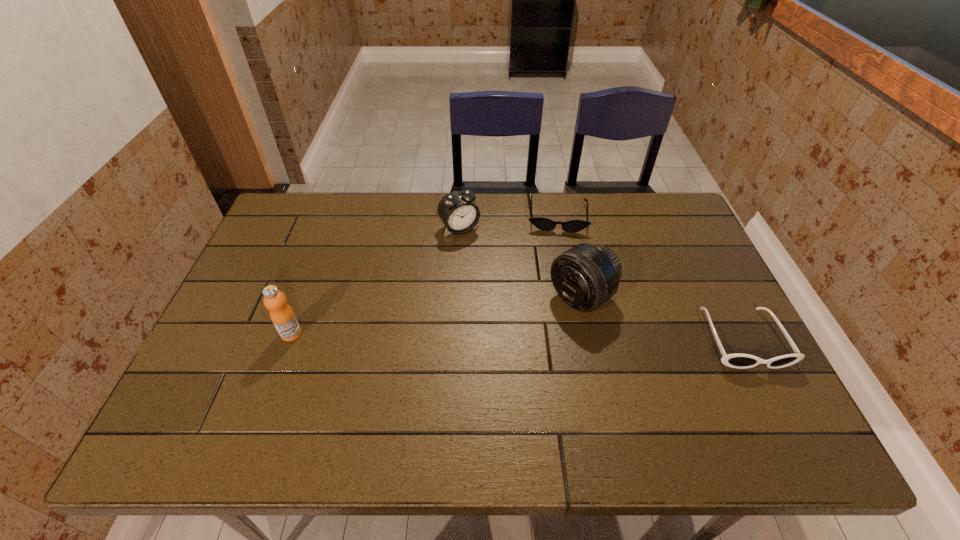
You are a GUI agent. You are given a task and a screenshot of the screen. Output one action in this format:
    pyautogui.click(x=<x>, y=<y>)
    Task: Click on the free space located on the front side of the third shortest object
    
    Given the screenshot: What is the action you would take?
    pyautogui.click(x=504, y=284)

Where is `free space located 0.240m on the front side of the third shortest object`? free space located 0.240m on the front side of the third shortest object is located at coordinates click(x=508, y=289).

Identify the location of vacant space located 0.320m on the front side of the third shortest object. The image size is (960, 540). (523, 308).

Where is `vacant space located 0.330m on the front-facing side of the shorter sunglasses`? vacant space located 0.330m on the front-facing side of the shorter sunglasses is located at coordinates (558, 315).

Identify the location of vacant space located on the front-facing side of the shorter sunglasses. The width and height of the screenshot is (960, 540). (558, 323).

Locate an element on the screen. The height and width of the screenshot is (540, 960). free space located 0.260m on the front-facing side of the shorter sunglasses is located at coordinates pyautogui.click(x=558, y=295).

Identify the location of vacant space situated on the front-facing side of the telephoto lens. Image resolution: width=960 pixels, height=540 pixels. (467, 379).

You are a GUI agent. You are given a task and a screenshot of the screen. Output one action in this format:
    pyautogui.click(x=<x>, y=<y>)
    Task: Click on the vacant space located 0.270m on the front-facing side of the telephoto lens
    This screenshot has width=960, height=540.
    Given the screenshot: What is the action you would take?
    479,370

Identify the location of vacant space located on the front-facing side of the telephoto lens. The width and height of the screenshot is (960, 540). (x=479, y=370).

Locate an element on the screen. The width and height of the screenshot is (960, 540). alarm clock that is at the far edge is located at coordinates (458, 212).